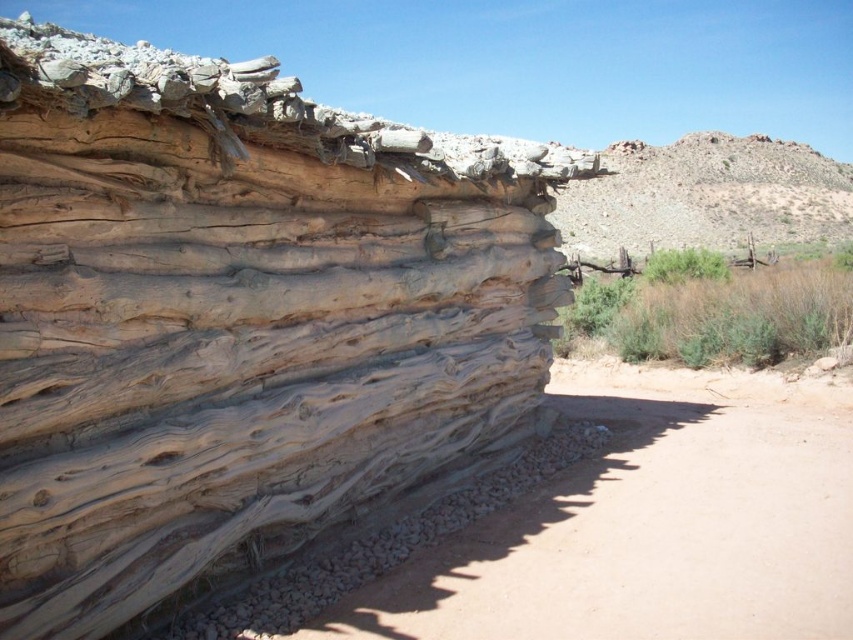
Question: Which of the following is the closest to the observer?

Choices:
 (A) (299, 269)
 (B) (650, 540)

Answer: (A)

Question: Which point is farther to the camera?

Choices:
 (A) smooth beige rock at center
 (B) brown dirt track at lower left

Answer: (B)

Question: Where is smooth beige rock at center located in relation to brown dirt track at lower left in the image?

Choices:
 (A) above
 (B) below

Answer: (A)

Question: Is smooth beige rock at center behind brown dirt track at lower left?

Choices:
 (A) yes
 (B) no

Answer: (B)

Question: Is smooth beige rock at center to the left of brown dirt track at lower left from the viewer's perspective?

Choices:
 (A) no
 (B) yes

Answer: (B)

Question: Which point appears farthest from the camera in this image?

Choices:
 (A) (553, 484)
 (B) (141, 566)

Answer: (A)